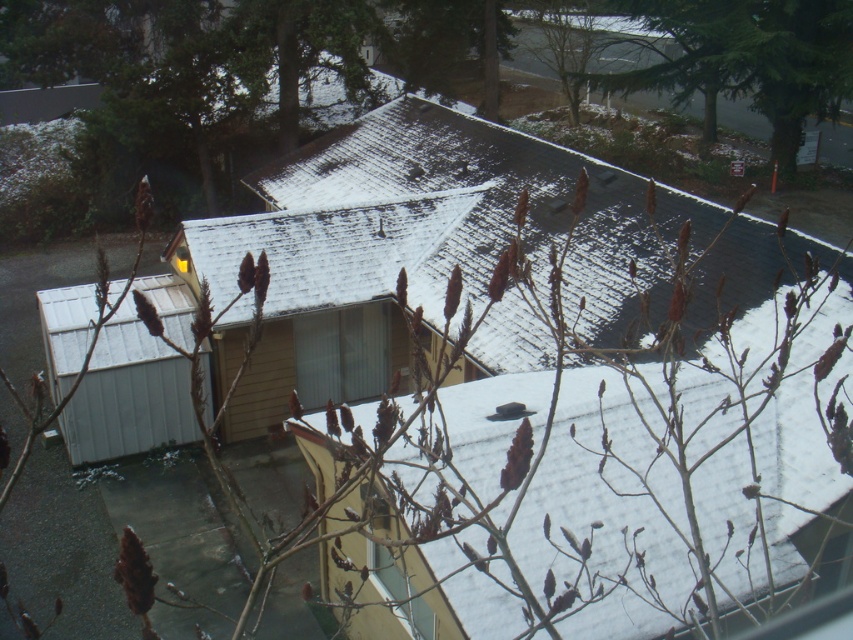
Can you confirm if green textured tree at upper right is positioned above clear glass window at center?

Correct, green textured tree at upper right is located above clear glass window at center.

Consider the image. Does green textured tree at upper right lie behind clear glass window at center?

That is True.

Between point (799, 38) and point (393, 580), which one is positioned behind?

The point (799, 38) is more distant.

Where is `green textured tree at upper right`? green textured tree at upper right is located at coordinates point(747,60).

Can you confirm if wooden cabin at center is smaller than clear glass window at center?

No, wooden cabin at center is not smaller than clear glass window at center.

Can you confirm if wooden cabin at center is positioned to the left of clear glass window at center?

In fact, wooden cabin at center is to the right of clear glass window at center.

Where is `wooden cabin at center`? The height and width of the screenshot is (640, 853). wooden cabin at center is located at coordinates (376, 225).

Measure the distance between point (x=164, y=291) and camera.

Point (x=164, y=291) and camera are 62.91 feet apart from each other.

Can you confirm if metallic gray shed at left is wider than clear glass window at center?

Correct, the width of metallic gray shed at left exceeds that of clear glass window at center.

Identify the location of metallic gray shed at left. (135, 380).

What are the coordinates of `metallic gray shed at left` in the screenshot? It's located at (135, 380).